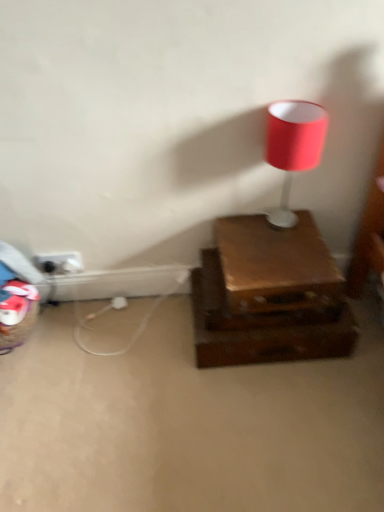
Question: Are matte red lampshade at upper right and shiny brown drawer at center located far from each other?

Choices:
 (A) yes
 (B) no

Answer: (B)

Question: Is matte red lampshade at upper right at the right side of shiny brown drawer at center?

Choices:
 (A) no
 (B) yes

Answer: (B)

Question: From a real-world perspective, is matte red lampshade at upper right located higher than shiny brown drawer at center?

Choices:
 (A) no
 (B) yes

Answer: (B)

Question: Is matte red lampshade at upper right smaller than shiny brown drawer at center?

Choices:
 (A) yes
 (B) no

Answer: (A)

Question: Is matte red lampshade at upper right oriented towards shiny brown drawer at center?

Choices:
 (A) no
 (B) yes

Answer: (A)

Question: From the image's perspective, is shiny brown drawer at center above or below matte red lampshade at upper right?

Choices:
 (A) above
 (B) below

Answer: (B)

Question: In terms of height, does shiny brown drawer at center look taller or shorter compared to matte red lampshade at upper right?

Choices:
 (A) tall
 (B) short

Answer: (B)

Question: Visually, is shiny brown drawer at center positioned to the left or to the right of matte red lampshade at upper right?

Choices:
 (A) left
 (B) right

Answer: (A)

Question: Considering the positions of shiny brown drawer at center and matte red lampshade at upper right in the image, is shiny brown drawer at center bigger or smaller than matte red lampshade at upper right?

Choices:
 (A) big
 (B) small

Answer: (A)

Question: From the image's perspective, is black plastic outlet at lower left positioned above or below shiny brown drawer at center?

Choices:
 (A) below
 (B) above

Answer: (B)

Question: Considering the positions of black plastic outlet at lower left and shiny brown drawer at center in the image, is black plastic outlet at lower left wider or thinner than shiny brown drawer at center?

Choices:
 (A) thin
 (B) wide

Answer: (A)

Question: From a real-world perspective, is black plastic outlet at lower left physically located above or below shiny brown drawer at center?

Choices:
 (A) below
 (B) above

Answer: (B)

Question: Considering the positions of black plastic outlet at lower left and shiny brown drawer at center in the image, is black plastic outlet at lower left taller or shorter than shiny brown drawer at center?

Choices:
 (A) tall
 (B) short

Answer: (B)

Question: Looking at the image, does matte red lampshade at upper right seem bigger or smaller compared to shiny brown drawer at center?

Choices:
 (A) big
 (B) small

Answer: (B)

Question: Considering the positions of point (286, 167) and point (301, 258), is point (286, 167) closer or farther from the camera than point (301, 258)?

Choices:
 (A) closer
 (B) farther

Answer: (A)